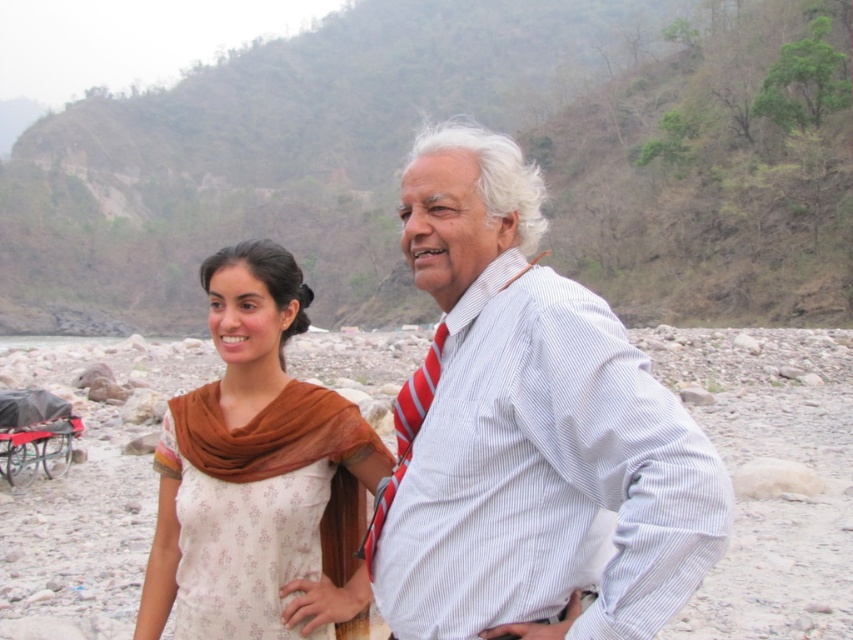
You are standing at the point with coordinates point (375, 531) and want to walk to the point with coordinates point (694, 580). Which direction should you move in?

You should move forward because point (694, 580) is in front of point (375, 531) from your current position.

Based on the scene description, where is the white striped shirt at center located in terms of coordinates?

The white striped shirt at center is located at coordinates point (529, 433).

You are standing at the center of the image and want to find the white striped shirt at center. Which direction should you look to locate it?

The white striped shirt at center is located at point [529,433], so you should look to the right side of the center to locate it.